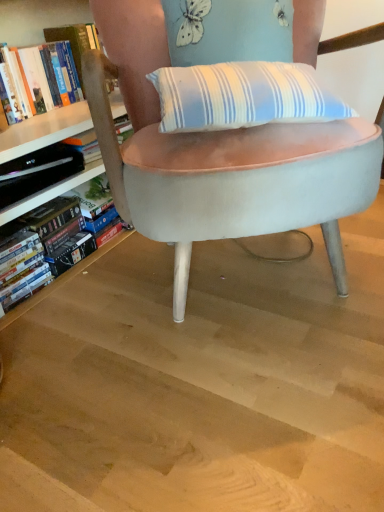
Question: Are hardcover book at left, which is the 1th book in top-to-bottom order, and velvet light blue chair at center located far from each other?

Choices:
 (A) yes
 (B) no

Answer: (B)

Question: Is hardcover book at left, which appears as the 2th book when ordered from the bottom, oriented towards velvet light blue chair at center?

Choices:
 (A) no
 (B) yes

Answer: (B)

Question: Is hardcover book at left, which is the 1th book in top-to-bottom order, at the left side of velvet light blue chair at center?

Choices:
 (A) no
 (B) yes

Answer: (B)

Question: Considering the relative positions of hardcover book at left, which is the 1th book in top-to-bottom order, and velvet light blue chair at center in the image provided, is hardcover book at left, which is the 1th book in top-to-bottom order, behind velvet light blue chair at center?

Choices:
 (A) yes
 (B) no

Answer: (A)

Question: From the image's perspective, would you say hardcover book at left, which is the 1th book in top-to-bottom order, is positioned over velvet light blue chair at center?

Choices:
 (A) yes
 (B) no

Answer: (A)

Question: Considering the relative sizes of hardcover book at left, which is the 1th book in top-to-bottom order, and velvet light blue chair at center in the image provided, is hardcover book at left, which is the 1th book in top-to-bottom order, smaller than velvet light blue chair at center?

Choices:
 (A) yes
 (B) no

Answer: (A)

Question: Does light brown wood at center appear on the left side of hardcover book at left, the 1th book positioned from the bottom?

Choices:
 (A) no
 (B) yes

Answer: (A)

Question: From a real-world perspective, is light brown wood at center located higher than hardcover book at left, the 2th book from the top?

Choices:
 (A) no
 (B) yes

Answer: (A)

Question: Is light brown wood at center oriented towards hardcover book at left, the 1th book positioned from the bottom?

Choices:
 (A) no
 (B) yes

Answer: (B)

Question: From a real-world perspective, is light brown wood at center under hardcover book at left, the 2th book from the top?

Choices:
 (A) no
 (B) yes

Answer: (B)

Question: Is light brown wood at center closer to camera compared to hardcover book at left, the 1th book positioned from the bottom?

Choices:
 (A) no
 (B) yes

Answer: (B)

Question: Is light brown wood at center not inside hardcover book at left, the 1th book positioned from the bottom?

Choices:
 (A) no
 (B) yes

Answer: (B)

Question: From a real-world perspective, is hardcover book at left, the 1th book positioned from the bottom, over hardcover book at left, which appears as the 2th book when ordered from the bottom?

Choices:
 (A) no
 (B) yes

Answer: (A)